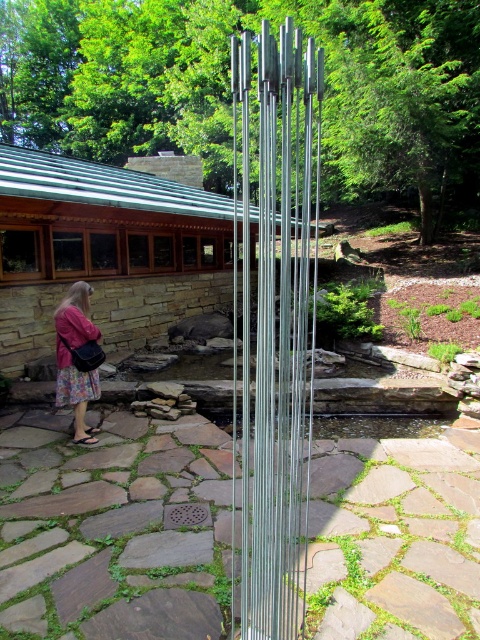
Question: Is silver metallic wind chime at center above floral skirt at lower left?

Choices:
 (A) no
 (B) yes

Answer: (B)

Question: Does silver metallic wind chime at center have a greater width compared to floral skirt at lower left?

Choices:
 (A) no
 (B) yes

Answer: (B)

Question: Does silver metallic wind chime at center appear on the left side of floral skirt at lower left?

Choices:
 (A) no
 (B) yes

Answer: (A)